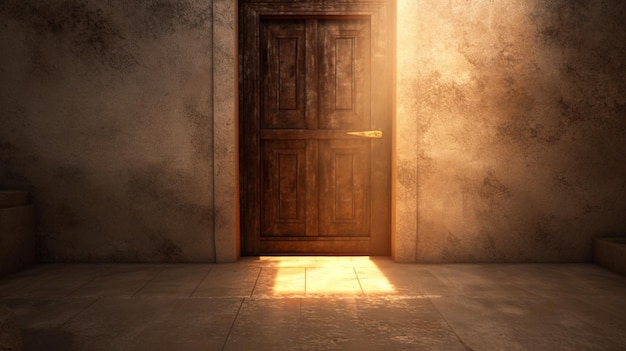
At what (x,y) coordinates should I click in order to perform the action: click on door knob. Please return your answer as a coordinate pair (x, y). Looking at the image, I should click on (369, 133).